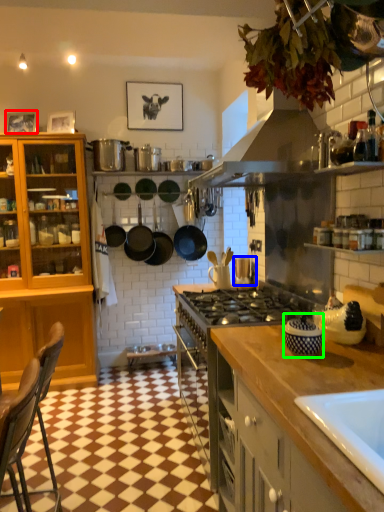
Question: Which object is the farthest from picture frame (highlighted by a red box)? Choose among these: appliance (highlighted by a blue box) or appliance (highlighted by a green box).

Choices:
 (A) appliance
 (B) appliance

Answer: (B)